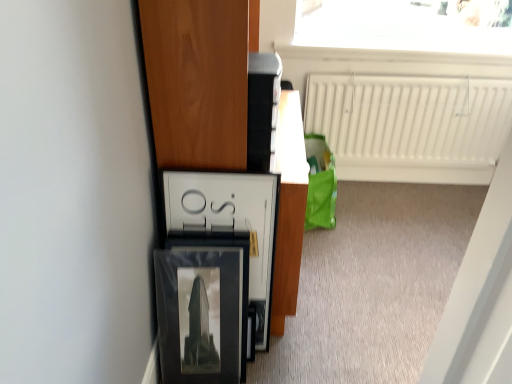
At what (x,y) coordinates should I click in order to perform the action: click on vacant space situated above matte black picture frame at lower left (from a real-world perspective). Please return your answer as a coordinate pair (x, y). Looking at the image, I should click on (199, 244).